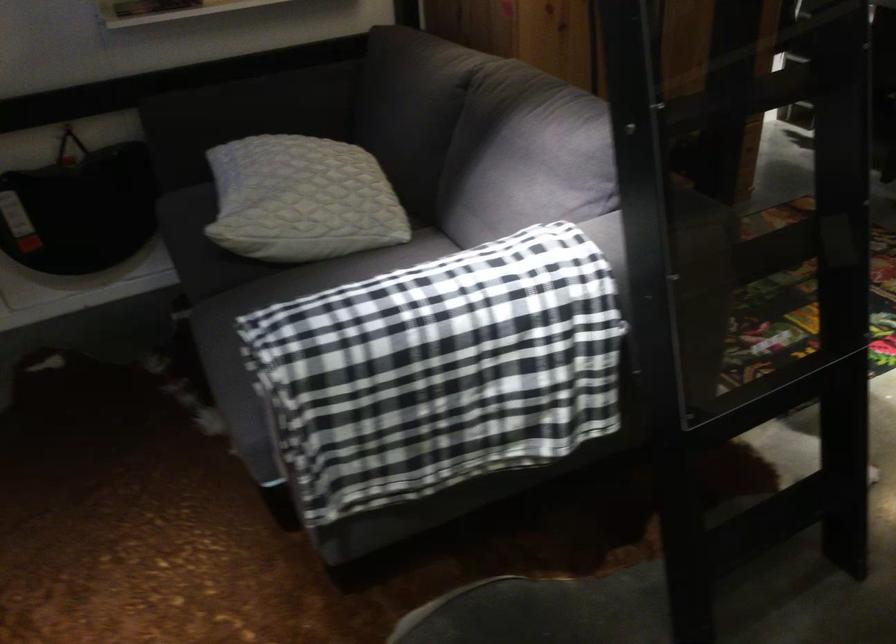
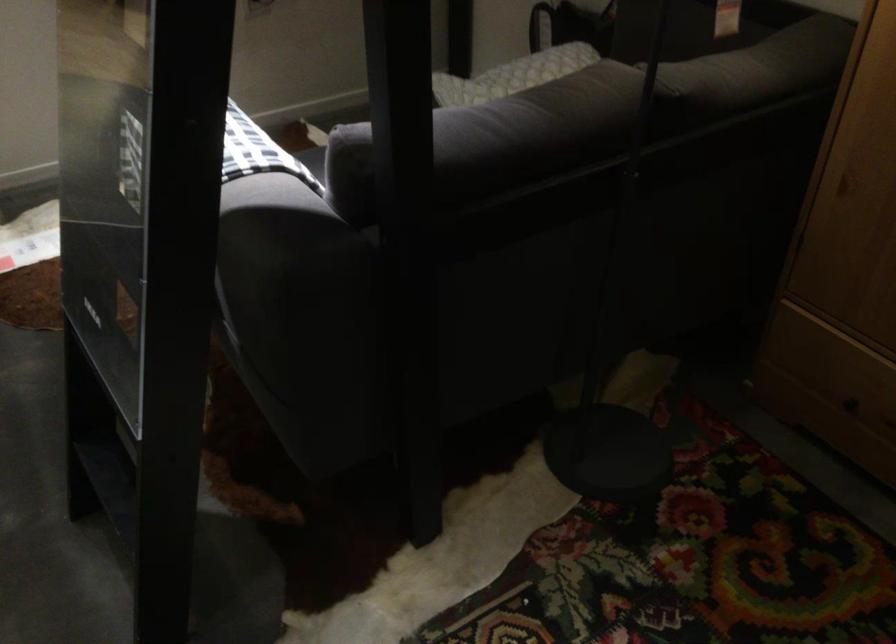
The point at (298, 163) is marked in the first image. Where is the corresponding point in the second image?

(528, 68)